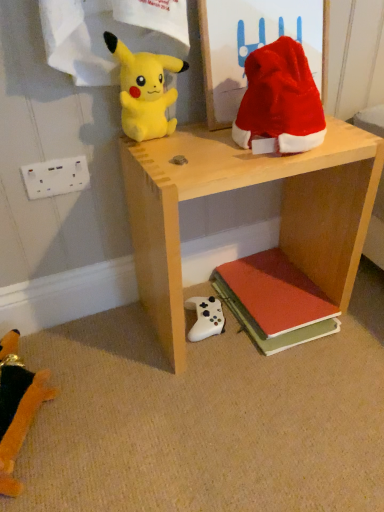
Question: Does velvet orange stuffed toy at lower left, which is the 4th toy in top-to-bottom order, have a larger size compared to white matte game controller at lower center, positioned as the second toy in bottom-to-top order?

Choices:
 (A) no
 (B) yes

Answer: (B)

Question: Is velvet orange stuffed toy at lower left, arranged as the first toy when viewed from the left, smaller than white matte game controller at lower center, the 3th toy positioned from the left?

Choices:
 (A) no
 (B) yes

Answer: (A)

Question: Considering the relative sizes of velvet orange stuffed toy at lower left, arranged as the first toy when viewed from the left, and white matte game controller at lower center, positioned as the second toy in bottom-to-top order, in the image provided, is velvet orange stuffed toy at lower left, arranged as the first toy when viewed from the left, wider than white matte game controller at lower center, positioned as the second toy in bottom-to-top order,?

Choices:
 (A) no
 (B) yes

Answer: (B)

Question: From a real-world perspective, is velvet orange stuffed toy at lower left, which is the 4th toy in top-to-bottom order, on white matte game controller at lower center, which is the 2th toy in right-to-left order?

Choices:
 (A) yes
 (B) no

Answer: (A)

Question: Could you tell me if velvet orange stuffed toy at lower left, arranged as the first toy when viewed from the left, is facing white matte game controller at lower center, the 3th toy positioned from the left?

Choices:
 (A) yes
 (B) no

Answer: (B)

Question: From the image's perspective, is velvet orange stuffed toy at lower left, which ranks as the fourth toy in right-to-left order, located above white matte game controller at lower center, positioned as the second toy in bottom-to-top order?

Choices:
 (A) yes
 (B) no

Answer: (B)

Question: Does white plastic/socket at lower left appear on the right side of light wood/unfinished wood shelf at center?

Choices:
 (A) no
 (B) yes

Answer: (A)

Question: From the image's perspective, would you say white plastic/socket at lower left is shown under light wood/unfinished wood shelf at center?

Choices:
 (A) no
 (B) yes

Answer: (A)

Question: Is white plastic/socket at lower left facing towards light wood/unfinished wood shelf at center?

Choices:
 (A) yes
 (B) no

Answer: (B)

Question: Is white plastic/socket at lower left touching light wood/unfinished wood shelf at center?

Choices:
 (A) yes
 (B) no

Answer: (B)

Question: Is white plastic/socket at lower left shorter than light wood/unfinished wood shelf at center?

Choices:
 (A) yes
 (B) no

Answer: (A)

Question: Is white plastic/socket at lower left not within light wood/unfinished wood shelf at center?

Choices:
 (A) no
 (B) yes

Answer: (B)

Question: Considering the relative sizes of white matte game controller at lower center, which is the 2th toy in right-to-left order, and white plastic/socket at lower left in the image provided, is white matte game controller at lower center, which is the 2th toy in right-to-left order, smaller than white plastic/socket at lower left?

Choices:
 (A) yes
 (B) no

Answer: (B)